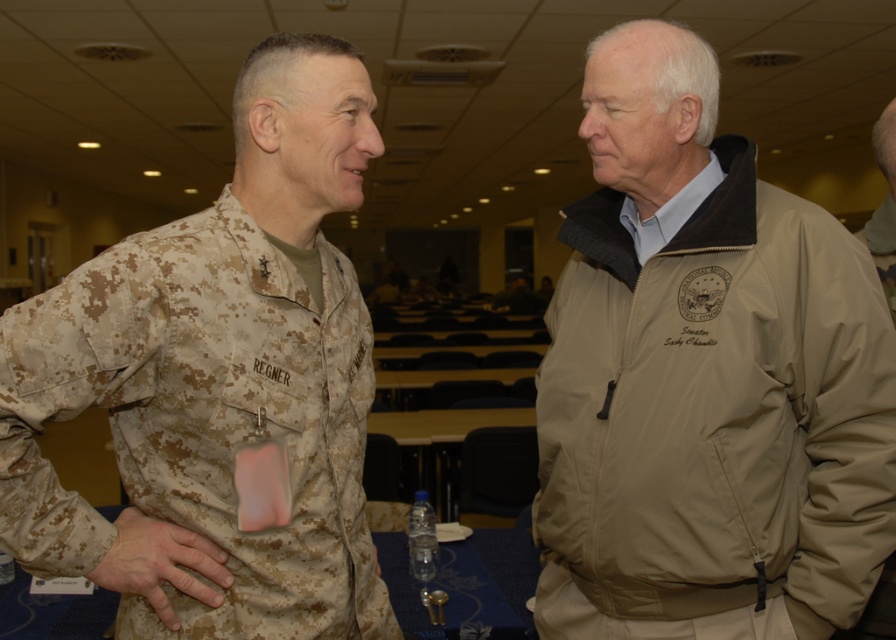
Is point (395, 636) farther from viewer compared to point (197, 586)?

Yes.

Can you confirm if camouflage fabric uniform at left is taller than camouflage fabric hand at center?

Yes, camouflage fabric uniform at left is taller than camouflage fabric hand at center.

Who is more distant from viewer, (277,550) or (102,573)?

Positioned behind is point (277,550).

This screenshot has width=896, height=640. What are the coordinates of `camouflage fabric uniform at left` in the screenshot? It's located at [201, 420].

The image size is (896, 640). What do you see at coordinates (705, 380) in the screenshot? I see `tan fabric jacket at center` at bounding box center [705, 380].

Is tan fabric jacket at center to the left of camouflage fabric uniform at left from the viewer's perspective?

Incorrect, tan fabric jacket at center is not on the left side of camouflage fabric uniform at left.

Who is more forward, (602, 180) or (71, 506)?

Positioned in front is point (71, 506).

The image size is (896, 640). What are the coordinates of `tan fabric jacket at center` in the screenshot? It's located at (705, 380).

Locate an element on the screen. tan fabric jacket at center is located at coordinates (705, 380).

Does tan fabric jacket at center come behind camouflage fabric hand at center?

Yes, it is behind camouflage fabric hand at center.

Identify the location of tan fabric jacket at center. The width and height of the screenshot is (896, 640). (705, 380).